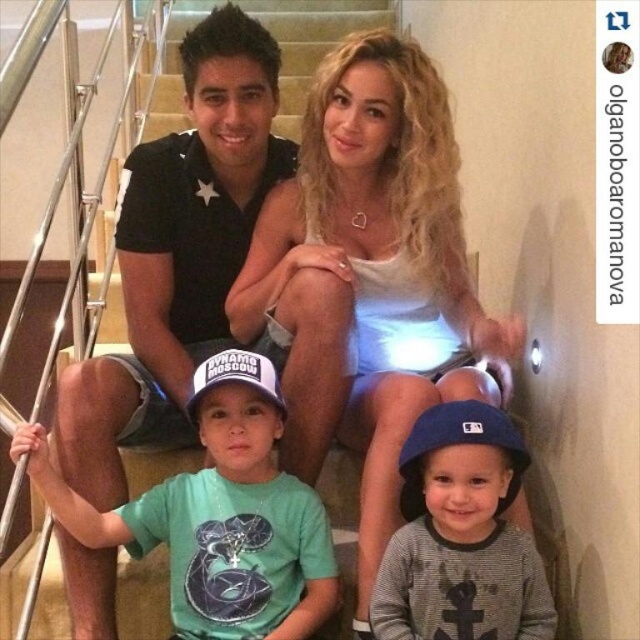
Question: Is white matte dress at center bigger than gray fleece sweatshirt at lower center?

Choices:
 (A) no
 (B) yes

Answer: (B)

Question: Considering the real-world distances, which object is farthest from the white matte dress at center?

Choices:
 (A) gray fleece sweatshirt at lower center
 (B) black cotton polo shirt at center
 (C) green cotton shirt at center

Answer: (C)

Question: Which point appears closest to the camera in this image?

Choices:
 (A) (340, 100)
 (B) (102, 440)
 (C) (33, 456)

Answer: (C)

Question: Which point is farther to the camera?

Choices:
 (A) (257, 77)
 (B) (301, 128)

Answer: (B)

Question: Is black cotton polo shirt at center further to the viewer compared to green cotton shirt at center?

Choices:
 (A) no
 (B) yes

Answer: (B)

Question: From the image, what is the correct spatial relationship of white matte dress at center in relation to green cotton shirt at center?

Choices:
 (A) below
 (B) above

Answer: (B)